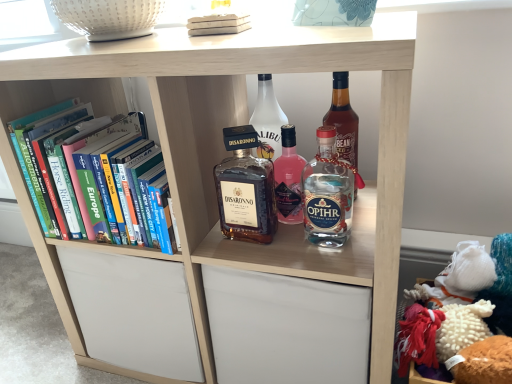
How much space does white glass bottle at center, marked as the second bottle in a left-to-right arrangement, occupy horizontally?

white glass bottle at center, marked as the second bottle in a left-to-right arrangement, is 2.82 inches wide.

In order to face white glass bottle at center, acting as the 2th bottle starting from the right, should I rotate leftwards or rightwards?

Rotate right and turn 2.157 degrees.

The image size is (512, 384). In order to click on clear glass bottle at center, the third bottle when ordered from left to right in this screenshot , I will do (x=328, y=193).

Describe the element at coordinates (64, 164) in the screenshot. I see `hardcover books at left, positioned as the first book in left-to-right order` at that location.

Image resolution: width=512 pixels, height=384 pixels. What do you see at coordinates (245, 189) in the screenshot?
I see `matte glass bottle at center, which is the third bottle in right-to-left order` at bounding box center [245, 189].

In order to face matte glass bottle at center, arranged as the first bottle when viewed from the left, should I rotate leftwards or rightwards?

Rotate left and turn 3.143 degrees.

Where is `white glass bottle at center, acting as the 2th bottle starting from the right`? This screenshot has height=384, width=512. white glass bottle at center, acting as the 2th bottle starting from the right is located at coordinates click(267, 120).

Who is shorter, clear glass bottle at center, the third bottle when ordered from left to right, or white matte book at upper center, the first book positioned from the front?

Result: white matte book at upper center, the first book positioned from the front, is shorter.

Who is bigger, clear glass bottle at center, the third bottle when ordered from left to right, or white matte book at upper center, the second book viewed from the left?

white matte book at upper center, the second book viewed from the left.

From the image's perspective, is clear glass bottle at center, which is the 1th bottle in right-to-left order, located above white matte book at upper center, marked as the first book in a top-to-bottom arrangement?

Incorrect, from the image's perspective, clear glass bottle at center, which is the 1th bottle in right-to-left order, is lower than white matte book at upper center, marked as the first book in a top-to-bottom arrangement.

Is clear glass bottle at center, which is the 1th bottle in right-to-left order, not inside white matte book at upper center, marked as the first book in a top-to-bottom arrangement?

Yes, clear glass bottle at center, which is the 1th bottle in right-to-left order, is outside of white matte book at upper center, marked as the first book in a top-to-bottom arrangement.

Are white matte book at upper center, marked as the first book in a top-to-bottom arrangement, and white glass bottle at center, acting as the 2th bottle starting from the right, far apart?

They are positioned close to each other.

From the image's perspective, would you say white matte book at upper center, the first book positioned from the front, is positioned over white glass bottle at center, marked as the second bottle in a left-to-right arrangement?

Yes.

Can you confirm if white matte book at upper center, the second book viewed from the left, is taller than white glass bottle at center, marked as the second bottle in a left-to-right arrangement?

No.

Considering the positions of objects matte glass bottle at center, arranged as the first bottle when viewed from the left, and clear glass bottle at center, the third bottle when ordered from left to right, in the image provided, who is more to the right, matte glass bottle at center, arranged as the first bottle when viewed from the left, or clear glass bottle at center, the third bottle when ordered from left to right,?

From the viewer's perspective, clear glass bottle at center, the third bottle when ordered from left to right, appears more on the right side.

Is matte glass bottle at center, which is the third bottle in right-to-left order, positioned beyond the bounds of clear glass bottle at center, the third bottle when ordered from left to right?

Yes, matte glass bottle at center, which is the third bottle in right-to-left order, is not within clear glass bottle at center, the third bottle when ordered from left to right.

Which is behind, point (257, 171) or point (309, 163)?

The point (309, 163) is more distant.

Can you tell me how much matte glass bottle at center, arranged as the first bottle when viewed from the left, and clear glass bottle at center, which is the 1th bottle in right-to-left order, differ in facing direction?

matte glass bottle at center, arranged as the first bottle when viewed from the left, and clear glass bottle at center, which is the 1th bottle in right-to-left order, are facing 0.000115 degrees away from each other.

Is white glass bottle at center, acting as the 2th bottle starting from the right, completely or partially inside hardcover books at left, the second book viewed from the top?

No, white glass bottle at center, acting as the 2th bottle starting from the right, is located outside of hardcover books at left, the second book viewed from the top.

Is hardcover books at left, which is the 1th book from bottom to top, facing towards white glass bottle at center, acting as the 2th bottle starting from the right?

No, hardcover books at left, which is the 1th book from bottom to top, is not aimed at white glass bottle at center, acting as the 2th bottle starting from the right.

Does point (45, 172) come closer to viewer compared to point (253, 118)?

Yes, it is.

From a real-world perspective, is hardcover books at left, the second book viewed from the top, under white glass bottle at center, marked as the second bottle in a left-to-right arrangement?

Indeed, from a real-world perspective, hardcover books at left, the second book viewed from the top, is positioned beneath white glass bottle at center, marked as the second bottle in a left-to-right arrangement.

Considering the sizes of white matte book at upper center, the 2th book in the bottom-to-top sequence, and hardcover books at left, positioned as the first book in left-to-right order, in the image, is white matte book at upper center, the 2th book in the bottom-to-top sequence, wider or thinner than hardcover books at left, positioned as the first book in left-to-right order,?

Considering their sizes, white matte book at upper center, the 2th book in the bottom-to-top sequence, looks slimmer than hardcover books at left, positioned as the first book in left-to-right order.

Who is more distant, white matte book at upper center, positioned as the 1th book in right-to-left order, or hardcover books at left, positioned as the first book in left-to-right order?

hardcover books at left, positioned as the first book in left-to-right order, is further away from the camera.

Between white matte book at upper center, marked as the first book in a top-to-bottom arrangement, and hardcover books at left, the second book positioned from the front, which one has smaller size?

With smaller size is white matte book at upper center, marked as the first book in a top-to-bottom arrangement.

From a real-world perspective, which object stands above the other?

From a 3D spatial view, white matte book at upper center, the second book positioned from the back, is above.

Is hardcover books at left, the second book viewed from the top, positioned beyond the bounds of white matte book at upper center, marked as the first book in a top-to-bottom arrangement?

hardcover books at left, the second book viewed from the top, lies outside white matte book at upper center, marked as the first book in a top-to-bottom arrangement,'s area.

Where is `book below the white matte book at upper center, the 2th book in the bottom-to-top sequence (from the image's perspective)`? The height and width of the screenshot is (384, 512). book below the white matte book at upper center, the 2th book in the bottom-to-top sequence (from the image's perspective) is located at coordinates click(64, 164).

From a real-world perspective, is hardcover books at left, which is the 1th book from bottom to top, positioned over white matte book at upper center, the second book positioned from the back, based on gravity?

No.

Can you confirm if hardcover books at left, positioned as the first book in left-to-right order, is bigger than white matte book at upper center, positioned as the 1th book in right-to-left order?

Yes, hardcover books at left, positioned as the first book in left-to-right order, is bigger than white matte book at upper center, positioned as the 1th book in right-to-left order.

From a real-world perspective, is matte glass bottle at center, which is the third bottle in right-to-left order, located higher than white matte book at upper center, the second book viewed from the left?

Incorrect, from a real-world perspective, matte glass bottle at center, which is the third bottle in right-to-left order, is lower than white matte book at upper center, the second book viewed from the left.

From the image's perspective, which is above, matte glass bottle at center, which is the third bottle in right-to-left order, or white matte book at upper center, the first book positioned from the front?

white matte book at upper center, the first book positioned from the front, is shown above in the image.

Is matte glass bottle at center, which is the third bottle in right-to-left order, behind white matte book at upper center, the first book positioned from the front?

Yes, matte glass bottle at center, which is the third bottle in right-to-left order, is behind white matte book at upper center, the first book positioned from the front.

Is matte glass bottle at center, which is the third bottle in right-to-left order, inside the boundaries of white matte book at upper center, the first book positioned from the front, or outside?

matte glass bottle at center, which is the third bottle in right-to-left order, is outside white matte book at upper center, the first book positioned from the front.

At what (x,y) coordinates should I click in order to perform the action: click on the 3rd bottle to the right of the white matte book at upper center, marked as the first book in a top-to-bottom arrangement, counting from the anchor's position. Please return your answer as a coordinate pair (x, y). Image resolution: width=512 pixels, height=384 pixels. Looking at the image, I should click on click(328, 193).

From the white glass bottle at center, marked as the second bottle in a left-to-right arrangement, count the 1st book to the left and point to it. Please provide its 2D coordinates.

[(218, 24)]

Considering their positions, is matte glass bottle at center, which is the third bottle in right-to-left order, positioned closer to clear glass bottle at center, which is the 1th bottle in right-to-left order, than hardcover books at left, the second book from the right?

matte glass bottle at center, which is the third bottle in right-to-left order, is positioned closer to the anchor clear glass bottle at center, which is the 1th bottle in right-to-left order.

Considering their positions, is clear glass bottle at center, which is the 1th bottle in right-to-left order, positioned further to hardcover books at left, the second book from the right, than matte glass bottle at center, which is the third bottle in right-to-left order?

clear glass bottle at center, which is the 1th bottle in right-to-left order, is further to hardcover books at left, the second book from the right.

Based on their spatial positions, is white matte book at upper center, the first book positioned from the front, or clear glass bottle at center, which is the 1th bottle in right-to-left order, further from white glass bottle at center, marked as the second bottle in a left-to-right arrangement?

white matte book at upper center, the first book positioned from the front, is positioned further to the anchor white glass bottle at center, marked as the second bottle in a left-to-right arrangement.

When comparing their distances from white matte book at upper center, positioned as the 1th book in right-to-left order, does clear glass bottle at center, which is the 1th bottle in right-to-left order, or matte glass bottle at center, arranged as the first bottle when viewed from the left, seem further?

Based on the image, clear glass bottle at center, which is the 1th bottle in right-to-left order, appears to be further to white matte book at upper center, positioned as the 1th book in right-to-left order.

When comparing their distances from clear glass bottle at center, the third bottle when ordered from left to right, does matte glass bottle at center, arranged as the first bottle when viewed from the left, or white matte book at upper center, the first book positioned from the front, seem closer?

Based on the image, matte glass bottle at center, arranged as the first bottle when viewed from the left, appears to be nearer to clear glass bottle at center, the third bottle when ordered from left to right.

Which object lies further to the anchor point clear glass bottle at center, which is the 1th bottle in right-to-left order, white glass bottle at center, acting as the 2th bottle starting from the right, or matte glass bottle at center, which is the third bottle in right-to-left order?

white glass bottle at center, acting as the 2th bottle starting from the right, is further to clear glass bottle at center, which is the 1th bottle in right-to-left order.

Which object lies further to the anchor point hardcover books at left, positioned as the first book in left-to-right order, white matte book at upper center, the 2th book in the bottom-to-top sequence, or white glass bottle at center, marked as the second bottle in a left-to-right arrangement?

white glass bottle at center, marked as the second bottle in a left-to-right arrangement.

Based on the photo, which object lies further to the anchor point white matte book at upper center, marked as the first book in a top-to-bottom arrangement, white glass bottle at center, marked as the second bottle in a left-to-right arrangement, or hardcover books at left, the second book from the right?

The object further to white matte book at upper center, marked as the first book in a top-to-bottom arrangement, is hardcover books at left, the second book from the right.

The image size is (512, 384). Identify the location of book between hardcover books at left, the 1th book in the back-to-front sequence, and white glass bottle at center, marked as the second bottle in a left-to-right arrangement, from left to right. (218, 24).

Identify the location of bottle located between clear glass bottle at center, which is the 1th bottle in right-to-left order, and white glass bottle at center, acting as the 2th bottle starting from the right, in the depth direction. The image size is (512, 384). (245, 189).

At what (x,y) coordinates should I click in order to perform the action: click on book located between hardcover books at left, which is the 1th book from bottom to top, and clear glass bottle at center, the third bottle when ordered from left to right, in the left-right direction. Please return your answer as a coordinate pair (x, y). This screenshot has height=384, width=512. Looking at the image, I should click on (218, 24).

Where is `bottle between white matte book at upper center, the second book viewed from the left, and matte glass bottle at center, which is the third bottle in right-to-left order, in the vertical direction`? Image resolution: width=512 pixels, height=384 pixels. bottle between white matte book at upper center, the second book viewed from the left, and matte glass bottle at center, which is the third bottle in right-to-left order, in the vertical direction is located at coordinates (267, 120).